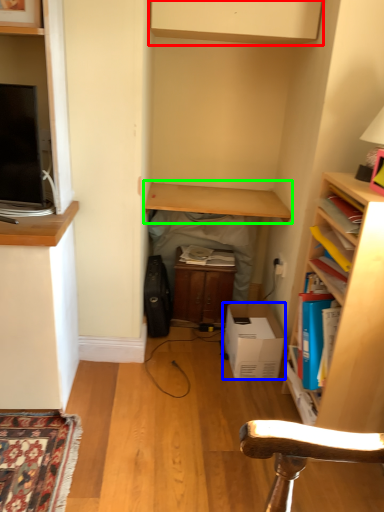
Question: Which object is positioned closest to cabinetry (highlighted by a red box)? Select from cardboard box (highlighted by a blue box) and table (highlighted by a green box).

Choices:
 (A) cardboard box
 (B) table

Answer: (B)